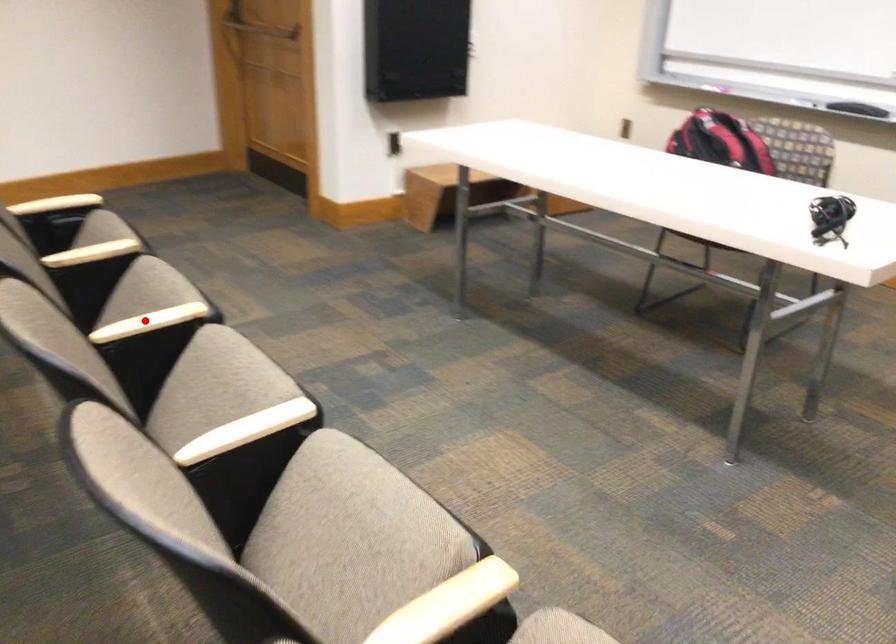
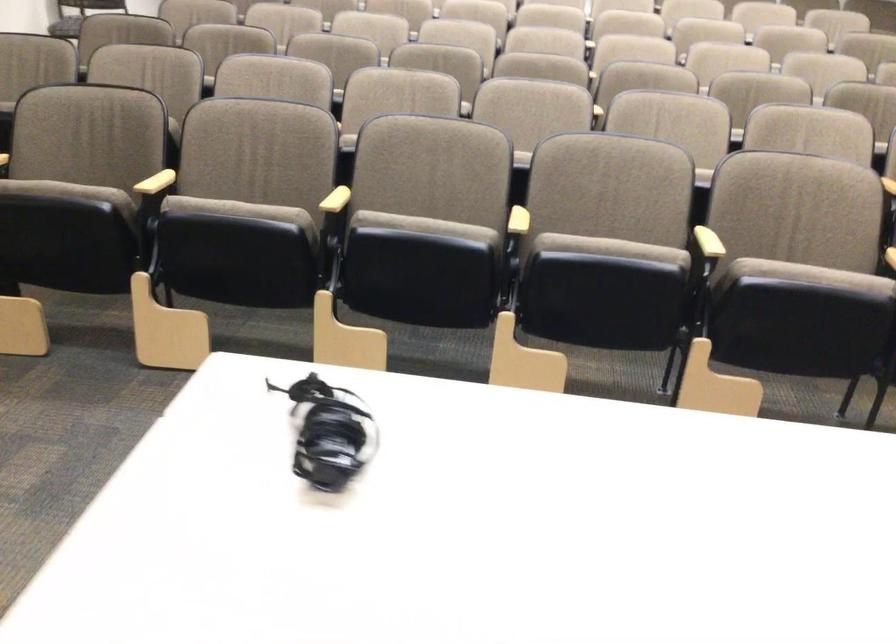
Question: I am providing you with two images of the same scene from different viewpoints. In image1, a red point is highlighted. Considering the same 3D point in image2, which of the following is correct?

Choices:
 (A) It is closer
 (B) It is farther

Answer: (B)